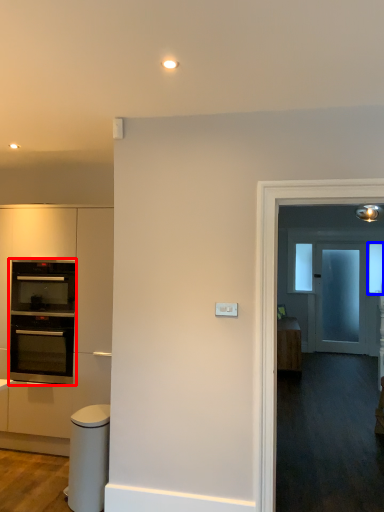
Question: Among these objects, which one is nearest to the camera, oven (highlighted by a red box) or window (highlighted by a blue box)?

Choices:
 (A) oven
 (B) window

Answer: (A)